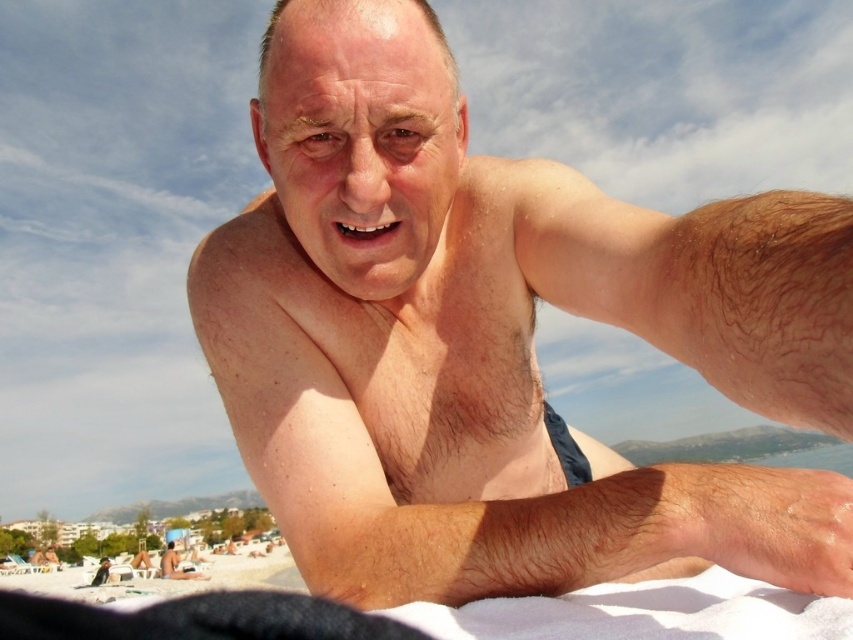
At what (x,y) coordinates should I click in order to perform the action: click on white sand at lower left. Please return your answer as a coordinate pair (x, y). Image resolution: width=853 pixels, height=640 pixels. Looking at the image, I should click on (164, 579).

Is point (99, 586) in front of point (172, 566)?

That is True.

Image resolution: width=853 pixels, height=640 pixels. I want to click on white sand at lower left, so click(164, 579).

Which is below, smooth skin man at center or matte skin at center?

matte skin at center is lower down.

Is point (680, 221) behind point (167, 552)?

No.

Which is behind, point (296, 285) or point (177, 568)?

The point (177, 568) is behind.

Where is `smooth skin man at center`? smooth skin man at center is located at coordinates pyautogui.click(x=498, y=340).

Which of these two, smooth skin man at center or white sand at lower left, stands shorter?

smooth skin man at center

Between point (566, 568) and point (123, 570), which one is positioned in front?

Point (566, 568)

What are the coordinates of `smooth skin man at center` in the screenshot? It's located at (498, 340).